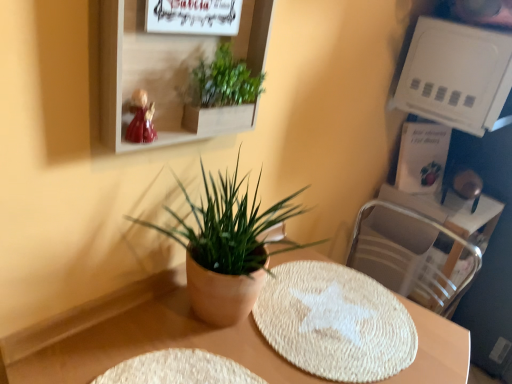
This screenshot has width=512, height=384. In order to click on vacant area that lies to the right of green matte plant at center, which ranks as the first houseplant in bottom-to-top order in this screenshot , I will do `click(324, 334)`.